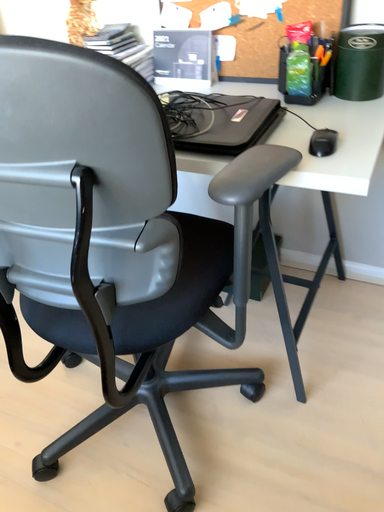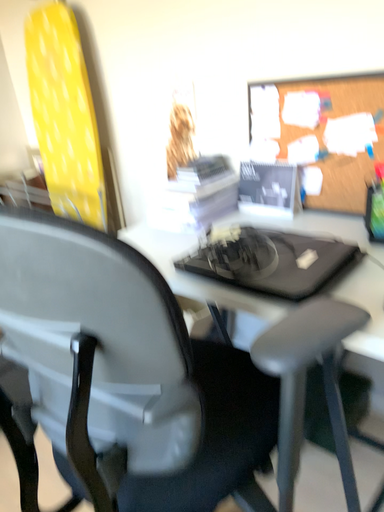
Question: Which way did the camera rotate in the video?

Choices:
 (A) rotated downward
 (B) rotated upward

Answer: (B)